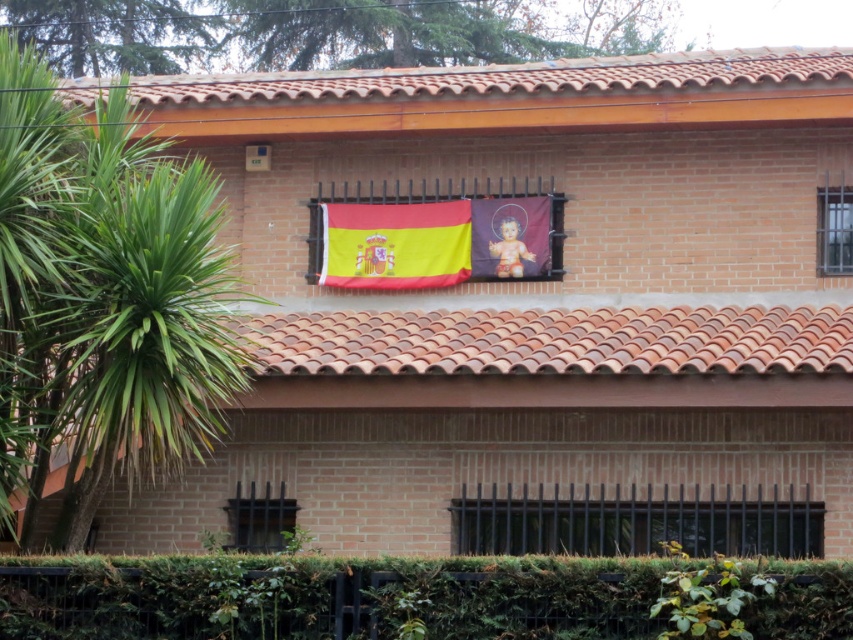
Is point (433, 218) more distant than point (271, 502)?

Yes.

Is yellowmaterialflag at center above black metal window at lower left?

Indeed, yellowmaterialflag at center is positioned over black metal window at lower left.

This screenshot has width=853, height=640. Identify the location of yellowmaterialflag at center. (395, 244).

Locate an element on the screen. The height and width of the screenshot is (640, 853). yellowmaterialflag at center is located at coordinates (395, 244).

How much distance is there between green leafy palm tree at left and terracotta tiles at center?

green leafy palm tree at left and terracotta tiles at center are 3.71 meters apart.

Can you confirm if green leafy palm tree at left is positioned above terracotta tiles at center?

Yes, green leafy palm tree at left is above terracotta tiles at center.

I want to click on green leafy palm tree at left, so click(103, 298).

Who is positioned more to the left, terracotta tiles at center or black metal bars at lower center?

Positioned to the left is terracotta tiles at center.

Between point (419, 333) and point (572, 524), which one is positioned behind?

Positioned behind is point (419, 333).

Where is `terracotta tiles at center`? The height and width of the screenshot is (640, 853). terracotta tiles at center is located at coordinates (555, 340).

Image resolution: width=853 pixels, height=640 pixels. Identify the location of terracotta tiles at center. [x=555, y=340].